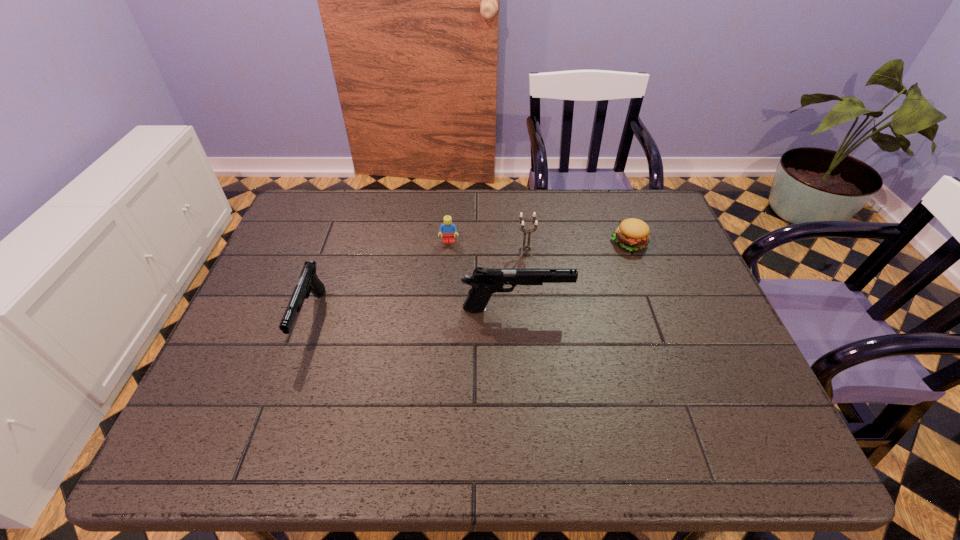
This screenshot has height=540, width=960. I want to click on the left gun, so click(309, 282).

The height and width of the screenshot is (540, 960). In order to click on the leftmost object in this screenshot , I will do `click(309, 282)`.

This screenshot has height=540, width=960. Identify the location of the right gun. (484, 282).

Identify the location of hamburger. The image size is (960, 540). (632, 234).

I want to click on the shortest object, so click(632, 234).

Where is `the second shortest object`? Image resolution: width=960 pixels, height=540 pixels. the second shortest object is located at coordinates (447, 228).

Locate an element on the screen. The width and height of the screenshot is (960, 540). the second object from left to right is located at coordinates (447, 228).

Identify the location of candle holder. Image resolution: width=960 pixels, height=540 pixels. (521, 221).

Where is `vacant space located 0.070m at the aiming end of the leftmost object`? This screenshot has height=540, width=960. vacant space located 0.070m at the aiming end of the leftmost object is located at coordinates (288, 383).

This screenshot has width=960, height=540. Identify the location of vacant region located 0.370m at the aiming end of the taller gun. (716, 309).